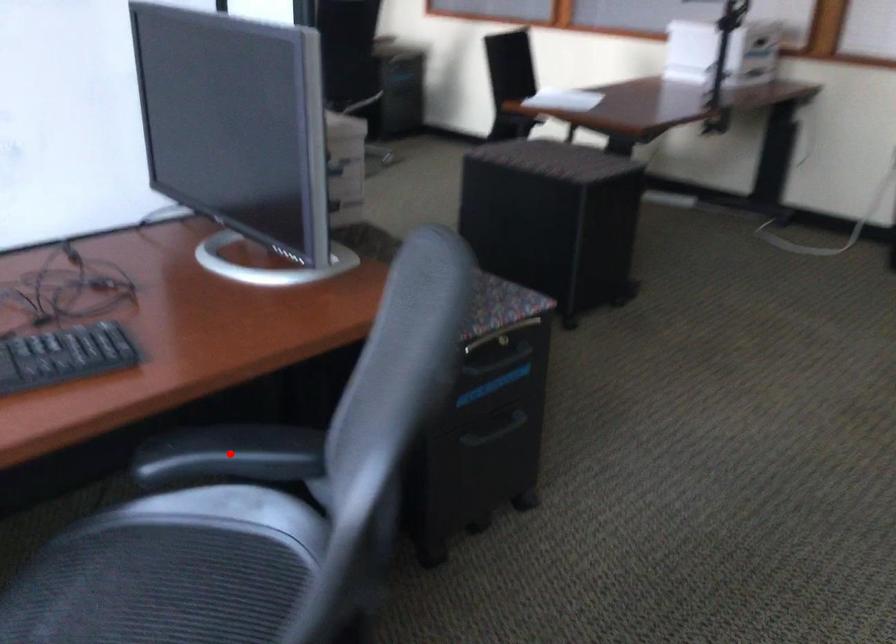
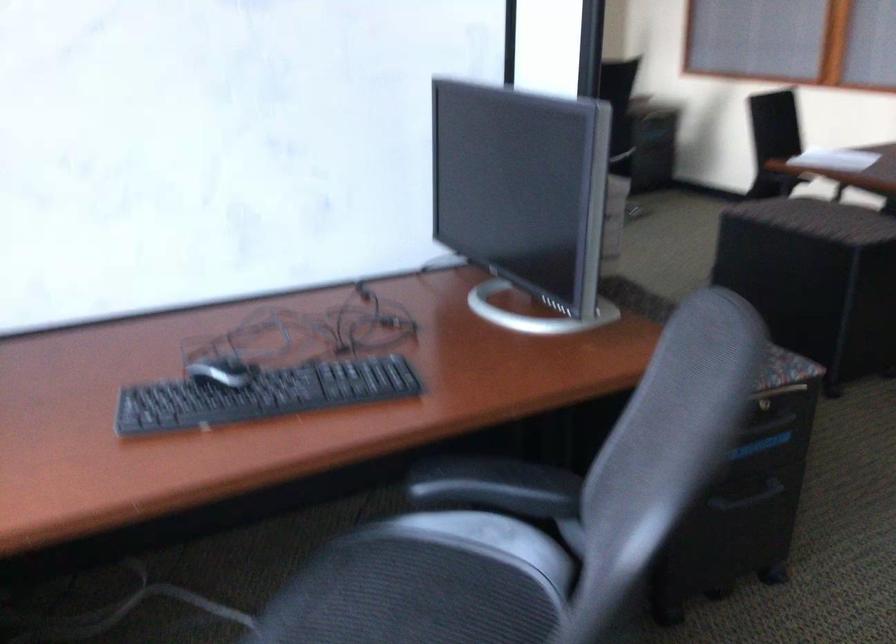
Locate, in the second image, the point that corresponds to the highlighted location in the first image.

(495, 486)